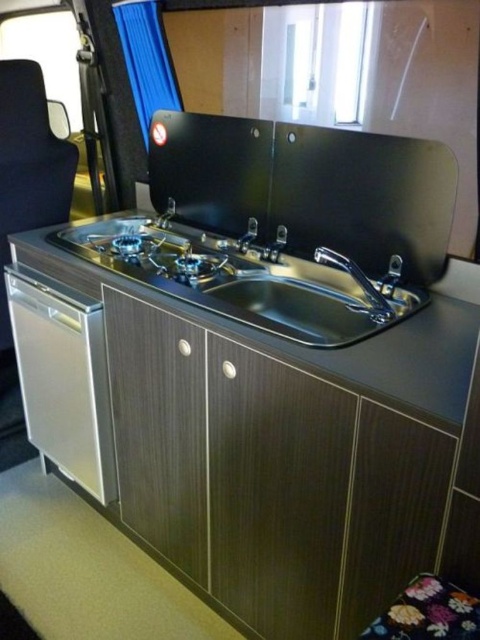
You are a chef preparing to install a new oven in the kitchenette. The oven you have is 28 inches wide. The existing oven is the satin silver oven at lower left. You want to place your new oven so it aligns with the satin nickel faucet at center. Can your new oven fit in the space between the existing oven and the faucet?

The satin silver oven at lower left is 28.17 inches from the satin nickel faucet at center. Since your new oven is 28 inches wide, it can fit in the space between the existing oven and the faucet as it is slightly narrower than the available space.

You are a mechanic inspecting the kitchenette of a motorhome. You notice two faucets in the sink area. According to the image, which faucet is positioned lower between the polished stainless steel faucet at center and the satin nickel faucet at center?

The polished stainless steel faucet at center is located below the satin nickel faucet at center, so it is positioned lower.

You are a repair technician trying to locate the faucet in the kitchenette. The faucet is at the center of the sink. Can you confirm the faucet is at point (358, 284)?

Yes, the point (358, 284) corresponds to the polished stainless steel faucet at center, so the faucet is indeed located at that coordinate.